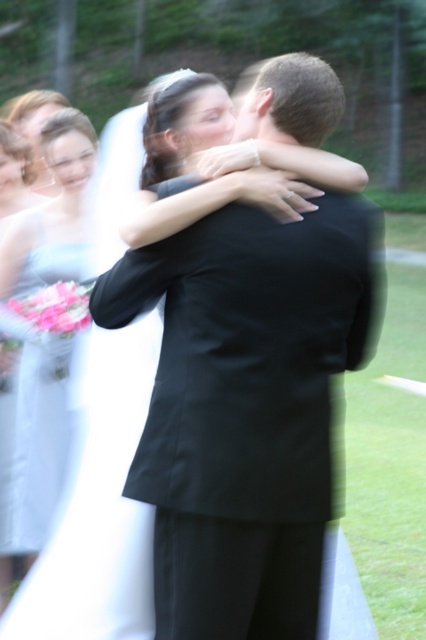
You are a photographer at the wedding and want to position yourself so that both the white satin dress at left and the matte white dress at left are fully visible in your shot. Given their height difference, which dress should you ensure is closer to the center of the frame to avoid being cut off?

The white satin dress at left is taller than the matte white dress at left, so you should position the white satin dress at left closer to the center of the frame to ensure it is fully visible without being cut off.

You are standing at the origin point of the coordinate system in the image. The black satin suit at center is located at point [247,406]. If you want to move towards the black satin suit at center, which direction should you move in terms of x and y coordinates?

The point [247,406] is the location of the black satin suit at center. Since you are at the origin, you need to move in the positive x and positive y direction to reach it.

You are a photographer at the wedding and want to ensure all guests can see the couple clearly. Considering the black satin suit at center and the matte white dress at left, which one might block the view more if positioned in front?

The black satin suit at center is bigger than the matte white dress at left, so it would block the view more if positioned in front.